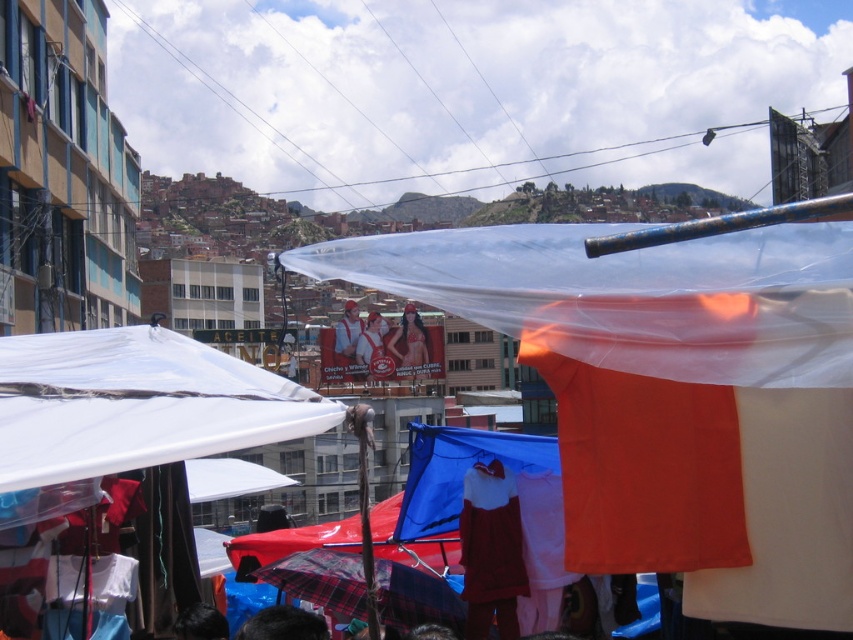
Between transparent plastic canopy at center and blue fabric canopy at center, which one is positioned lower?

blue fabric canopy at center is below.

The image size is (853, 640). Identify the location of transparent plastic canopy at center. (670, 392).

The width and height of the screenshot is (853, 640). In order to click on transparent plastic canopy at center in this screenshot , I will do `click(670, 392)`.

Is point (656, 333) positioned before point (415, 307)?

Yes, it is.

Find the location of a particular element. transparent plastic canopy at center is located at coordinates (670, 392).

Which of these two, blue fabric canopy at center or white fabric shirt at center, stands taller?

blue fabric canopy at center

Is blue fabric canopy at center further to camera compared to white fabric shirt at center?

No, blue fabric canopy at center is in front of white fabric shirt at center.

The image size is (853, 640). I want to click on blue fabric canopy at center, so click(459, 472).